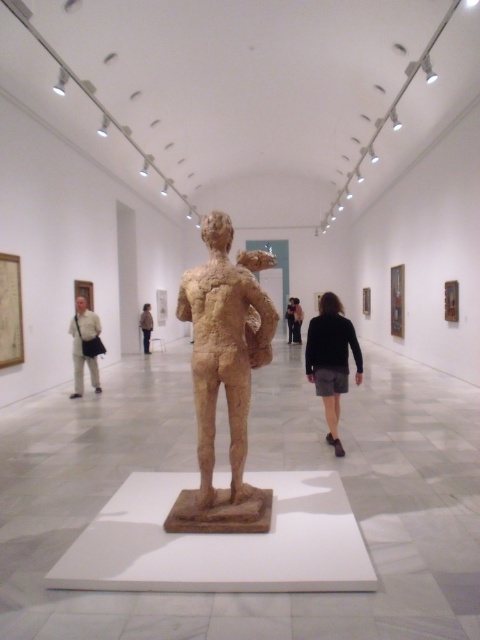
Between light beige pants at left and light brown textured sculpture at center, which one is positioned lower?

light beige pants at left

Can you confirm if light beige pants at left is smaller than light brown textured sculpture at center?

No, light beige pants at left is not smaller than light brown textured sculpture at center.

Does point (79, 390) come closer to viewer compared to point (147, 317)?

Yes, it is.

Locate an element on the screen. This screenshot has height=640, width=480. light beige pants at left is located at coordinates pyautogui.click(x=84, y=346).

Who is shorter, dark gray fabric skirt at center or light beige pants at left?

Standing shorter between the two is dark gray fabric skirt at center.

Can you confirm if dark gray fabric skirt at center is positioned to the left of light beige pants at left?

In fact, dark gray fabric skirt at center is to the right of light beige pants at left.

I want to click on dark gray fabric skirt at center, so click(x=331, y=358).

The height and width of the screenshot is (640, 480). I want to click on dark gray fabric skirt at center, so click(x=331, y=358).

Can you confirm if brown clay figure at center is positioned above light beige pants at left?

Indeed, brown clay figure at center is positioned over light beige pants at left.

Can you confirm if brown clay figure at center is thinner than light beige pants at left?

No, brown clay figure at center is not thinner than light beige pants at left.

Is point (201, 413) closer to camera compared to point (78, 310)?

Yes, point (201, 413) is in front of point (78, 310).

Identify the location of brown clay figure at center. (224, 376).